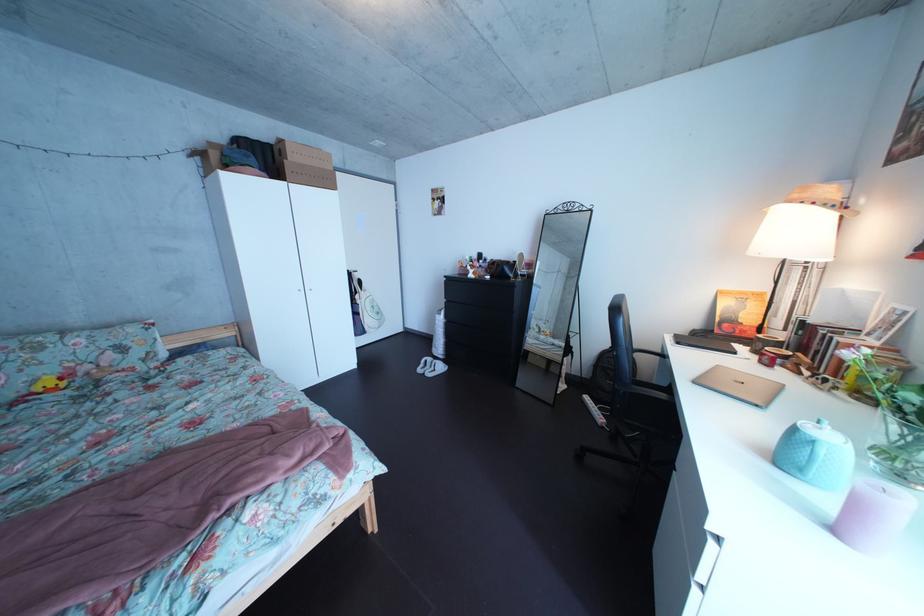
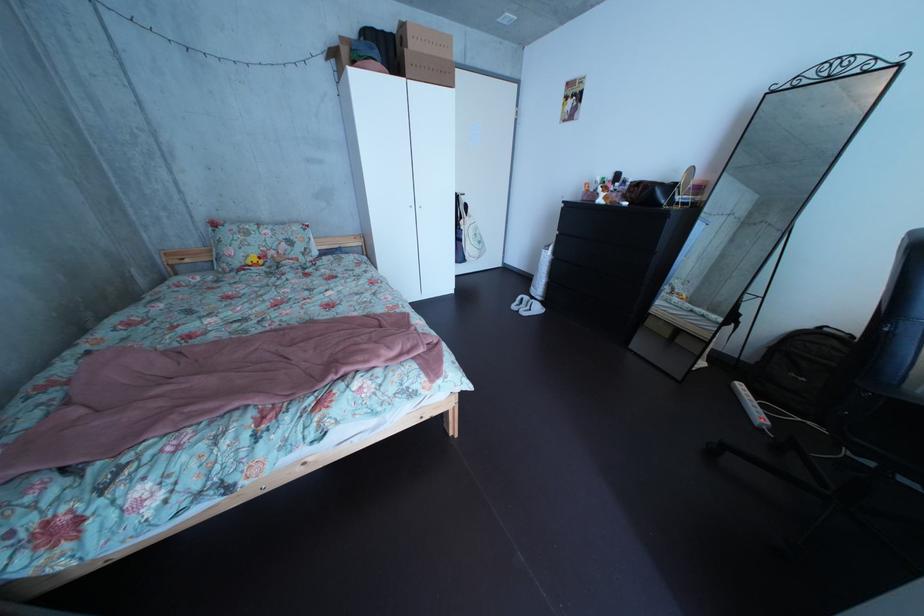
Where in the second image is the point corresponding to point (37, 383) from the first image?

(256, 260)